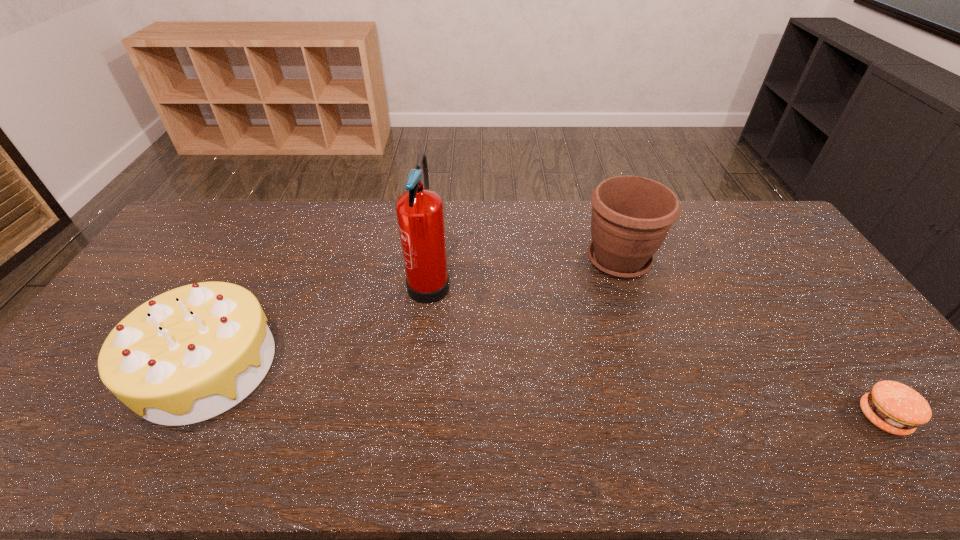
Image resolution: width=960 pixels, height=540 pixels. In order to click on fire extinguisher in this screenshot , I will do `click(420, 216)`.

Where is `the third object from right to left`? This screenshot has width=960, height=540. the third object from right to left is located at coordinates (420, 216).

Identify the location of the third shortest object. [x=631, y=216].

Locate an element on the screen. The width and height of the screenshot is (960, 540). flowerpot is located at coordinates (631, 216).

Where is `the leftmost object`? the leftmost object is located at coordinates point(187,355).

Locate an element on the screen. the third tallest object is located at coordinates (187, 355).

The width and height of the screenshot is (960, 540). Identify the location of patty. (896, 408).

Where is `the shortest object`? This screenshot has width=960, height=540. the shortest object is located at coordinates (896, 408).

This screenshot has height=540, width=960. I want to click on vacant space located 0.150m on the front of the fire extinguisher, so click(x=420, y=360).

Identify the location of free space located 0.290m on the front of the third shortest object. The image size is (960, 540). (655, 366).